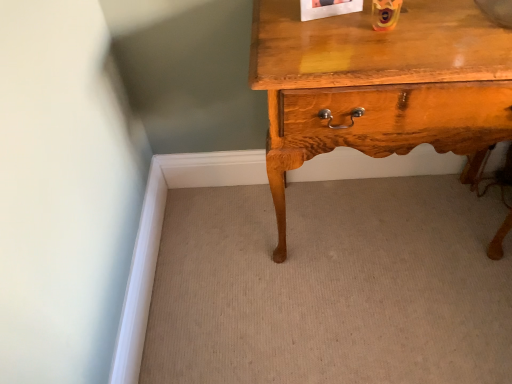
The width and height of the screenshot is (512, 384). In order to click on free point to the left of glossy wood nightstand at right in this screenshot , I will do `click(227, 271)`.